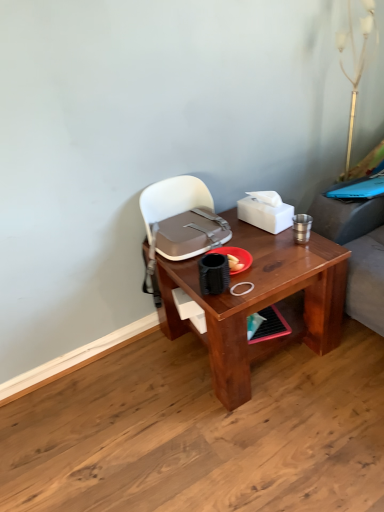
The image size is (384, 512). What are the coordinates of `vacant area that is in front of brown wooden desk at center` in the screenshot? It's located at [x=260, y=438].